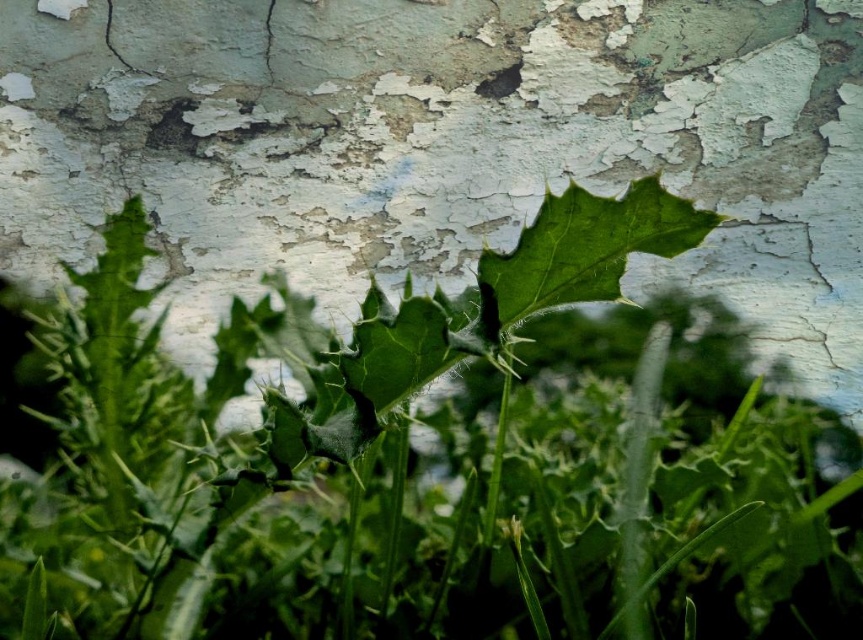
Question: Which point is farther to the camera?

Choices:
 (A) green spiky leaf at center
 (B) green matte leaf at center

Answer: (A)

Question: Is green spiky leaf at center bigger than green matte leaf at center?

Choices:
 (A) no
 (B) yes

Answer: (B)

Question: Can you confirm if green spiky leaf at center is positioned below green matte leaf at center?

Choices:
 (A) yes
 (B) no

Answer: (A)

Question: Which object is closer to the camera taking this photo?

Choices:
 (A) green spiky leaf at center
 (B) green matte leaf at center

Answer: (B)

Question: Does green spiky leaf at center have a larger size compared to green matte leaf at center?

Choices:
 (A) yes
 (B) no

Answer: (A)